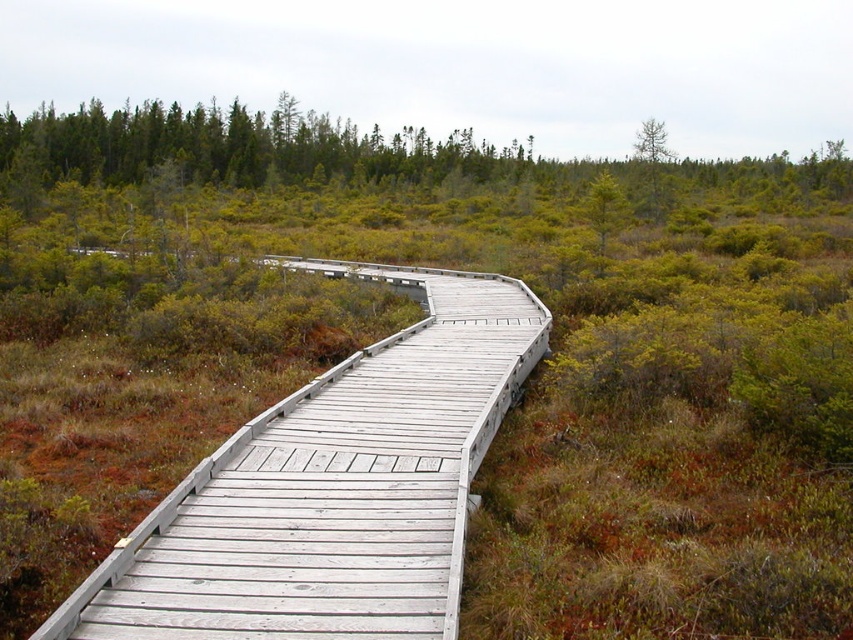
Does green matte tree at upper center come in front of green matte tree at upper right?

Yes, green matte tree at upper center is in front of green matte tree at upper right.

Does green matte tree at upper center have a smaller size compared to green matte tree at upper right?

Correct, green matte tree at upper center occupies less space than green matte tree at upper right.

Between point (601, 273) and point (650, 120), which one is positioned behind?

Point (650, 120)

You are a GUI agent. You are given a task and a screenshot of the screen. Output one action in this format:
    pyautogui.click(x=<x>, y=<y>)
    Task: Click on the green matte tree at upper center
    Image resolution: width=853 pixels, height=640 pixels.
    Given the screenshot: What is the action you would take?
    pyautogui.click(x=605, y=211)

Which is behind, point (444, 472) or point (602, 221)?

The point (602, 221) is behind.

Between light gray wooden bridge at center and green matte tree at upper center, which one is positioned lower?

light gray wooden bridge at center

Does point (509, 381) lie behind point (595, 189)?

No, (509, 381) is in front of (595, 189).

At what (x,y) coordinates should I click in order to perform the action: click on light gray wooden bridge at center. Please return your answer as a coordinate pair (x, y). Looking at the image, I should click on 332,486.

Who is shorter, light gray wooden bridge at center or green matte tree at upper right?

light gray wooden bridge at center

In the scene shown: Is the position of light gray wooden bridge at center more distant than that of green matte tree at upper right?

No.

Does point (276, 500) lie behind point (663, 205)?

No, (276, 500) is closer to viewer.

Locate an element on the screen. This screenshot has width=853, height=640. light gray wooden bridge at center is located at coordinates (332, 486).